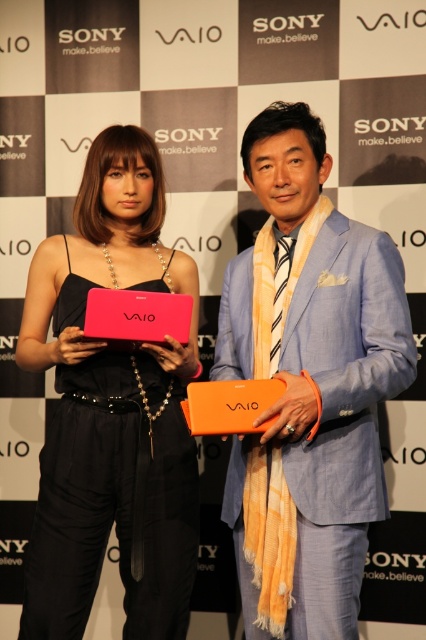
Question: From the image, what is the correct spatial relationship of orange fabric scarf at center in relation to matte pink laptop at center?

Choices:
 (A) below
 (B) above

Answer: (B)

Question: Which object appears farthest from the camera in this image?

Choices:
 (A) orange fabric scarf at center
 (B) matte pink laptop at center

Answer: (B)

Question: Is orange fabric scarf at center smaller than matte pink laptop at center?

Choices:
 (A) no
 (B) yes

Answer: (A)

Question: Which object is closer to the camera taking this photo?

Choices:
 (A) orange fabric scarf at center
 (B) matte pink laptop at center

Answer: (A)

Question: Among these objects, which one is nearest to the camera?

Choices:
 (A) matte pink laptop at center
 (B) orange fabric scarf at center

Answer: (B)

Question: Does orange fabric scarf at center have a larger size compared to matte pink laptop at center?

Choices:
 (A) yes
 (B) no

Answer: (A)